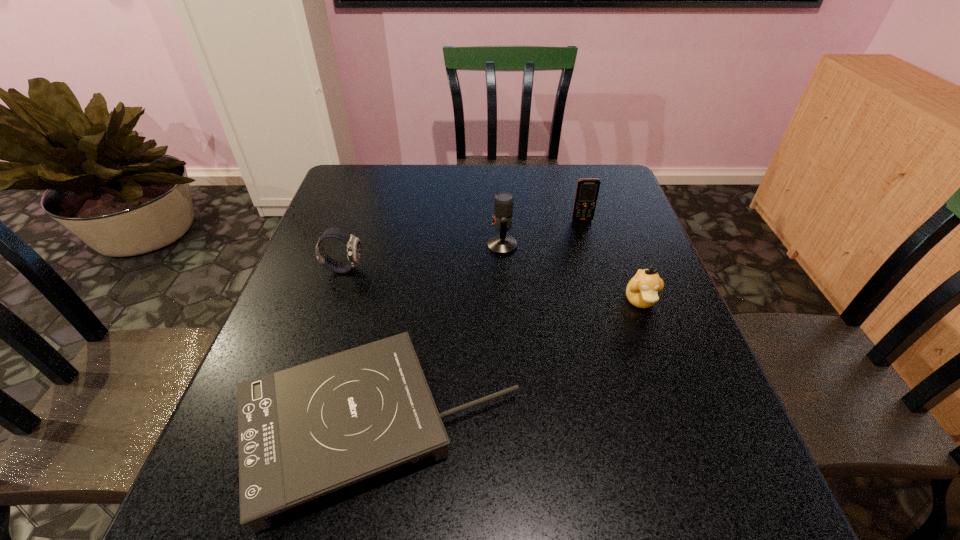
Identify the location of vacant space that is in between the watch and the cellular telephone. This screenshot has width=960, height=540. (463, 245).

This screenshot has width=960, height=540. In order to click on object that is the fourth closest to the nearest object in this screenshot , I will do `click(587, 190)`.

Identify which object is located as the fourth nearest to the second farthest object. Please provide its 2D coordinates. Your answer should be formatted as a tuple, i.e. [(x, y)], where the tuple contains the x and y coordinates of a point satisfying the conditions above.

[(354, 250)]

At what (x,y) coordinates should I click in order to perform the action: click on vacant space that satisfies the following two spatial constraints: 1. on the face of the watch; 2. on the left side of the hotplate. Please return your answer as a coordinate pair (x, y). Image resolution: width=960 pixels, height=540 pixels. Looking at the image, I should click on (291, 427).

Where is `vacant area in the image that satisfies the following two spatial constraints: 1. on the face of the watch; 2. on the left side of the shortest object`? vacant area in the image that satisfies the following two spatial constraints: 1. on the face of the watch; 2. on the left side of the shortest object is located at coordinates (291, 427).

What are the coordinates of `free space that satisfies the following two spatial constraints: 1. on the screen of the second object from right to left; 2. on the face of the third farthest object` in the screenshot? It's located at (596, 269).

Where is `vacant space that satisfies the following two spatial constraints: 1. on the screen of the cellular telephone; 2. on the face of the third farthest object`? The height and width of the screenshot is (540, 960). vacant space that satisfies the following two spatial constraints: 1. on the screen of the cellular telephone; 2. on the face of the third farthest object is located at coordinates (596, 269).